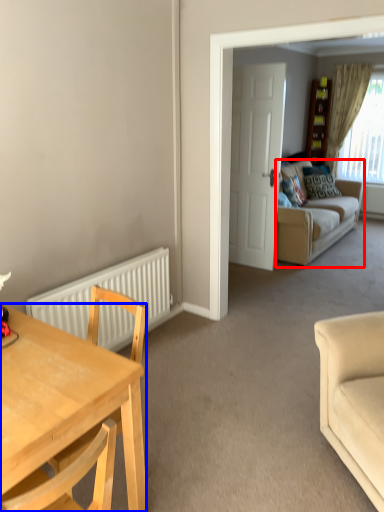
Question: Which of the following is the farthest to the observer, studio couch (highlighted by a red box) or desk (highlighted by a blue box)?

Choices:
 (A) studio couch
 (B) desk

Answer: (A)